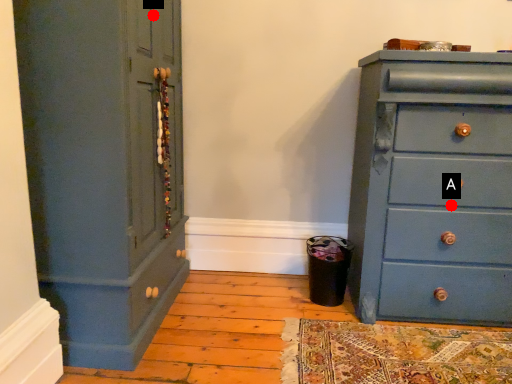
Question: Two points are circled on the image, labeled by A and B beside each circle. Which of the following is the closest to the observer?

Choices:
 (A) A is closer
 (B) B is closer

Answer: (B)